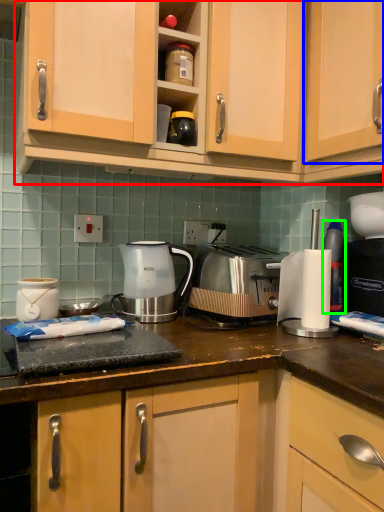
Question: Based on their relative distances, which object is farther from cabinetry (highlighted by a red box)? Choose from cabinetry (highlighted by a blue box) and bottle (highlighted by a green box).

Choices:
 (A) cabinetry
 (B) bottle

Answer: (B)